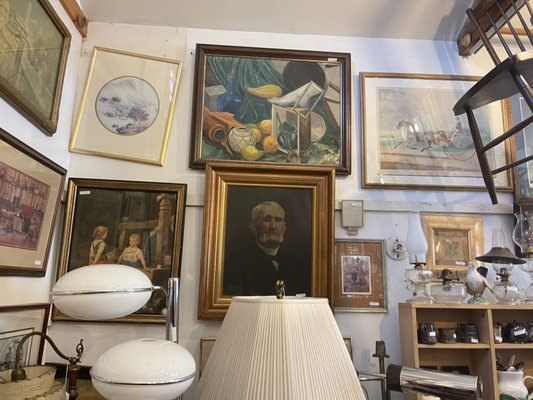
The width and height of the screenshot is (533, 400). I want to click on picture of picture wall gallery, so click(180, 156).